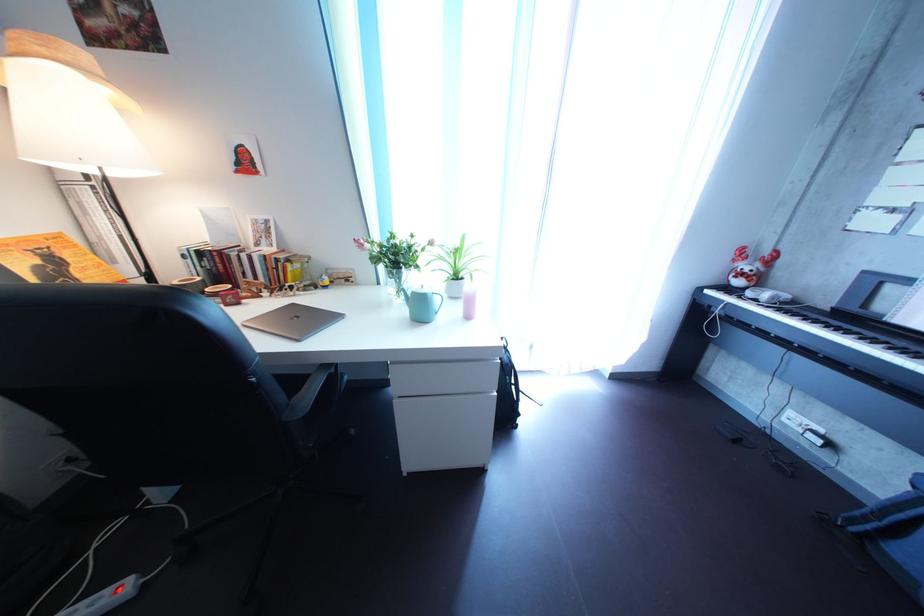
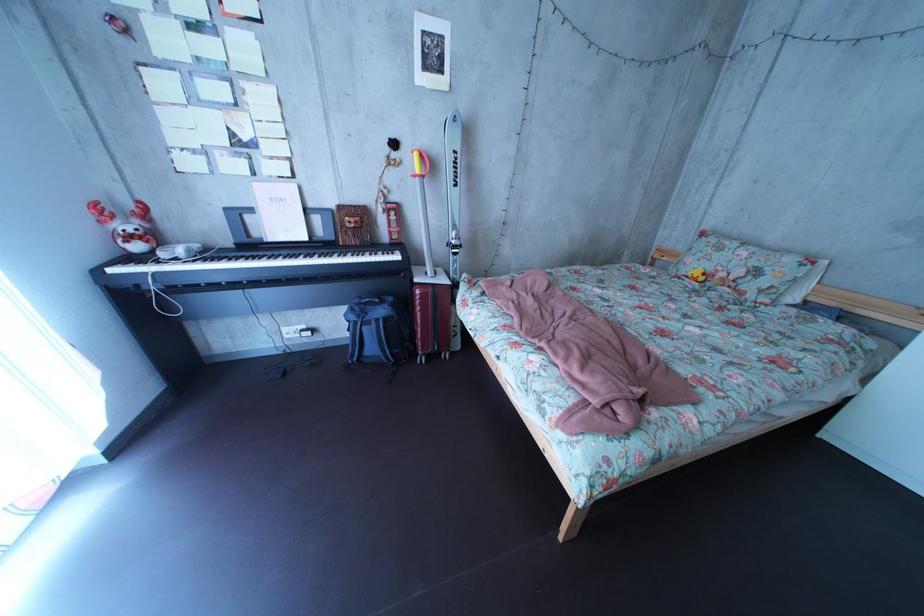
In the second image, find the point that corresponds to (x=805, y=315) in the first image.

(225, 262)